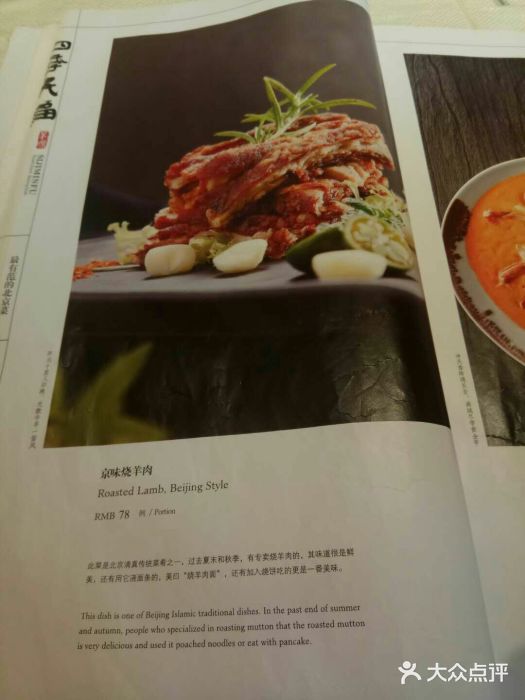
Find the location of a particular element. The width and height of the screenshot is (525, 700). inside of book cover is located at coordinates (13, 63).